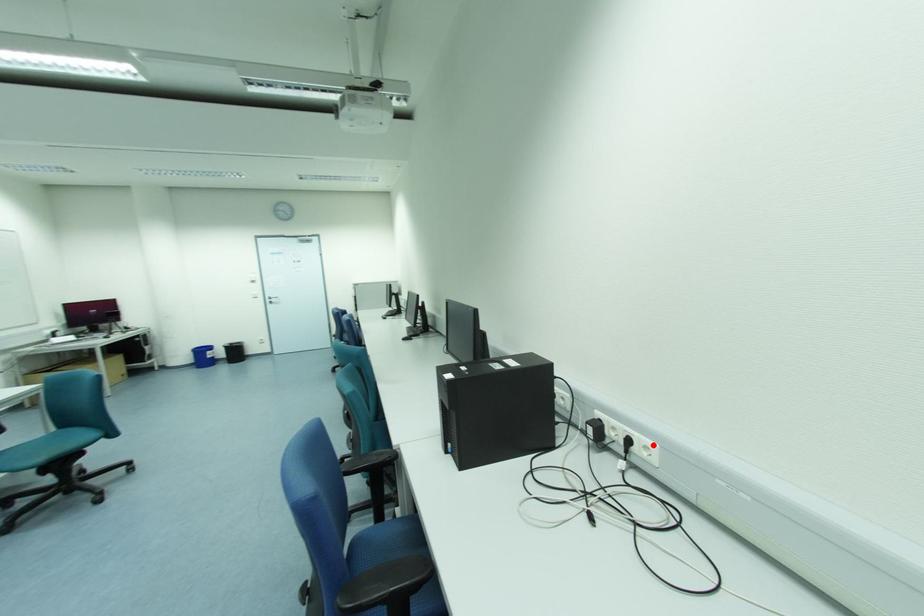
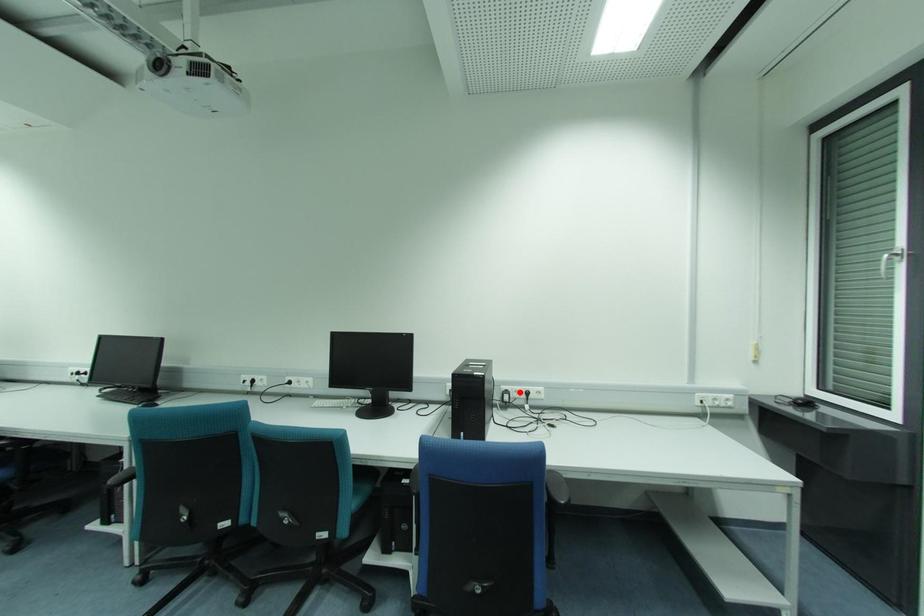
I am providing you with two images of the same scene from different viewpoints. A red point is marked on the first image and another point is marked on the second image. Are the points marked in image1 and image2 representing the same 3D position?

No